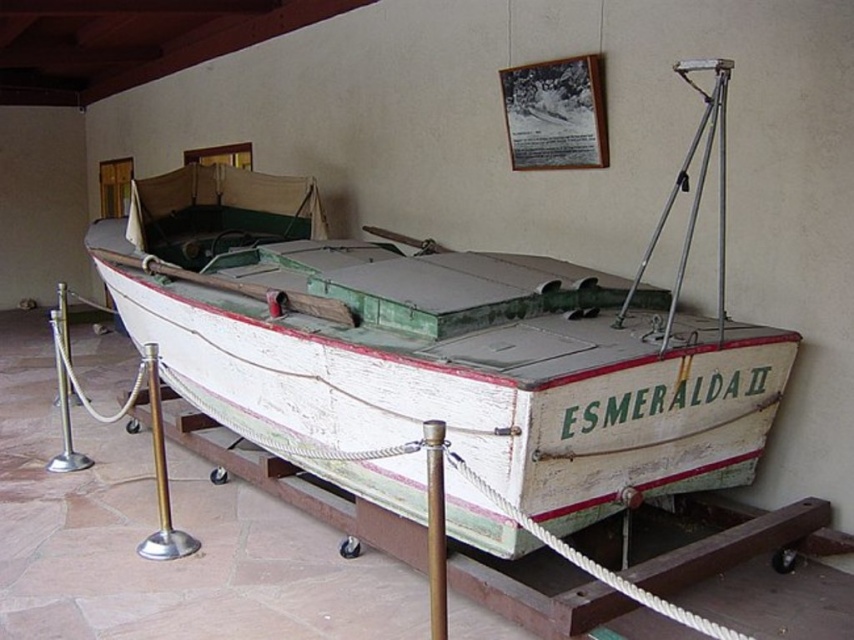
Who is taller, metallic silver frame at upper center or brushed metal pole at lower left?

brushed metal pole at lower left is taller.

Is point (513, 109) less distant than point (183, 547)?

No.

Identify the location of metallic silver frame at upper center. (554, 113).

Can you confirm if white wooden boat at center is wider than brown wooden pole at center?

Yes.

Is white wooden boat at center positioned behind brown wooden pole at center?

That is True.

Is point (776, 348) farther from camera compared to point (431, 509)?

Yes, point (776, 348) is farther from viewer.

The image size is (854, 640). Find the location of `white wooden boat at center`. white wooden boat at center is located at coordinates (437, 348).

Is metallic silver frame at upper center thinner than brown wooden pole at center?

Incorrect, metallic silver frame at upper center's width is not less than brown wooden pole at center's.

The height and width of the screenshot is (640, 854). In order to click on metallic silver frame at upper center in this screenshot , I will do `click(554, 113)`.

This screenshot has width=854, height=640. I want to click on metallic silver frame at upper center, so click(x=554, y=113).